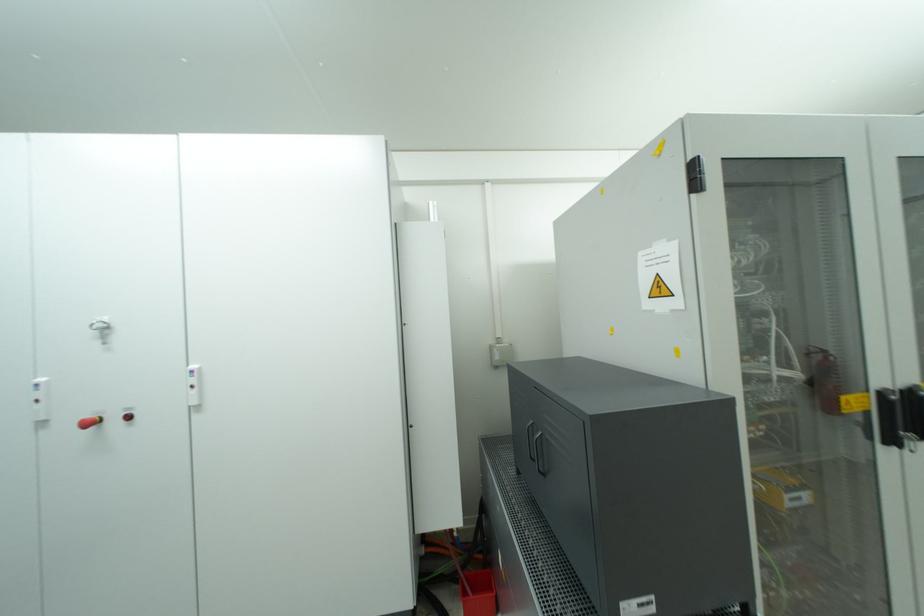
Where would you turn the metal T-handle key? Please return your answer as a coordinate pair (x, y).

(101, 329)